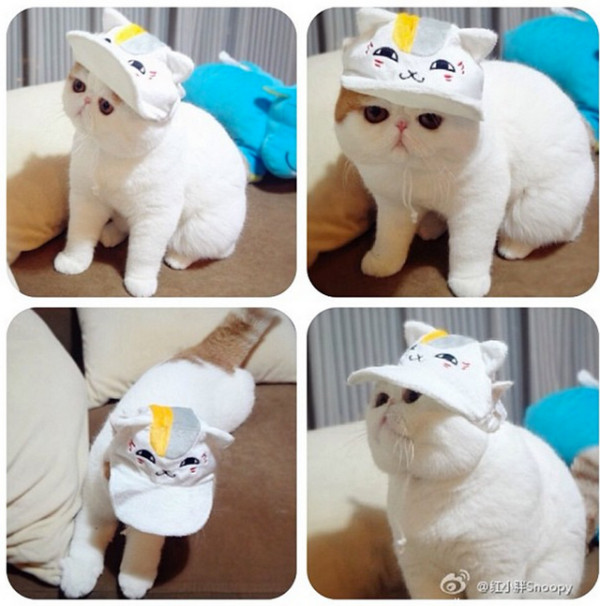
What are the coordinates of `bed` in the screenshot? It's located at (236, 478), (267, 247), (548, 278), (593, 571).